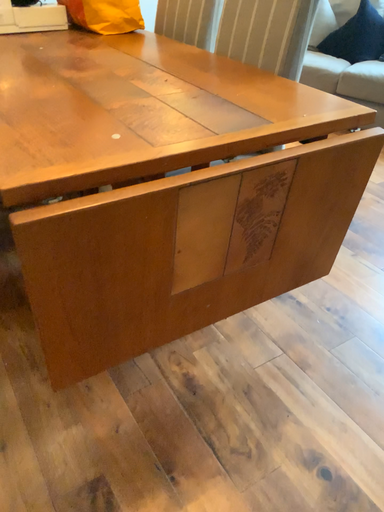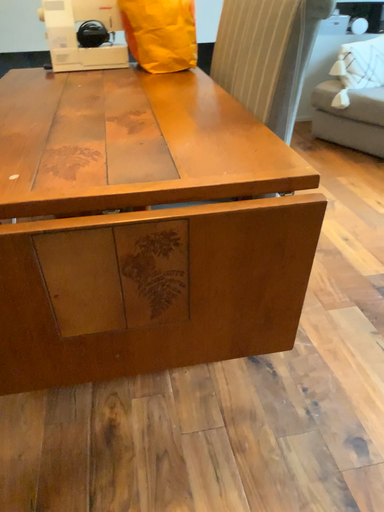
Question: Which way did the camera rotate in the video?

Choices:
 (A) rotated left
 (B) rotated right

Answer: (A)